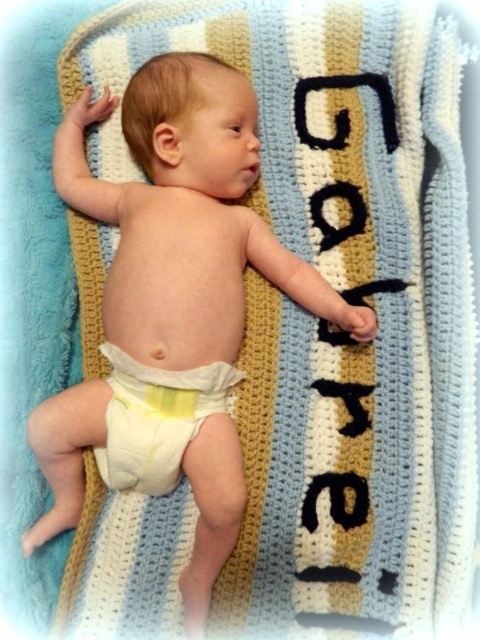
Who is more distant from viewer, (101, 195) or (123, 364)?

The point (101, 195) is behind.

Can you confirm if smooth white diaper at center is smaller than yellow fabric diaper at center?

Incorrect, smooth white diaper at center is not smaller in size than yellow fabric diaper at center.

This screenshot has width=480, height=640. I want to click on smooth white diaper at center, so click(x=170, y=301).